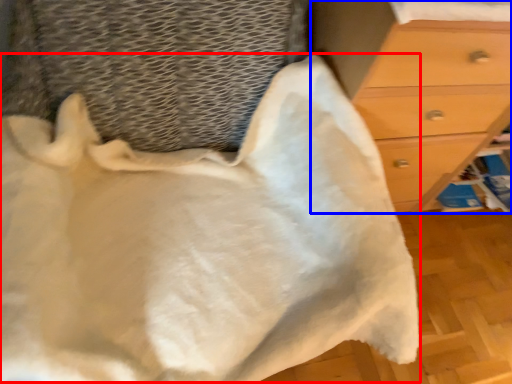
Question: Which point is further to the camera, blanket (highlighted by a red box) or chest of drawers (highlighted by a blue box)?

Choices:
 (A) blanket
 (B) chest of drawers

Answer: (B)